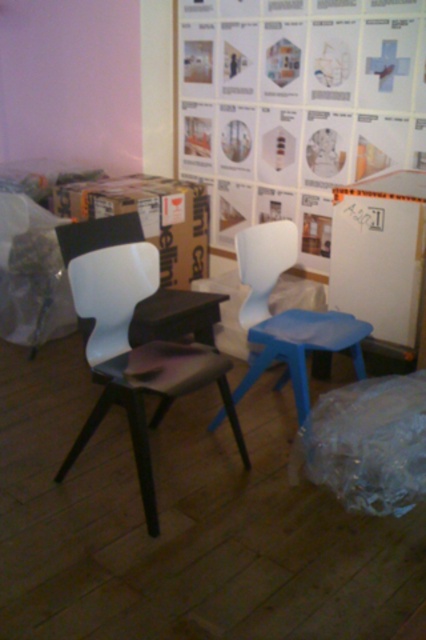
You are standing in the room and want to determine which of the two points, point (x=140, y=420) or point (x=178, y=307), is closer to you. Based on the scene description, which point is nearer?

Point (x=140, y=420) is closer to the viewer than point (x=178, y=307) according to the description.

You are organizing items in the room and need to place a transparent plastic bag at lower right and a cardboard box at center. Which item takes up more space?

The cardboard box at center takes up more space than the transparent plastic bag at lower right.

You are a person who is 170 cm tall. You want to sit on the matte white chair at center and work on a laptop placed on the black matte table at center. Considering your height and the chair and table heights, will your feet touch the ground?

The matte white chair at center is much taller than the black matte table at center. Since the chair is taller, your feet may not touch the ground when sitting on it, making it uncomfortable for working on the laptop.